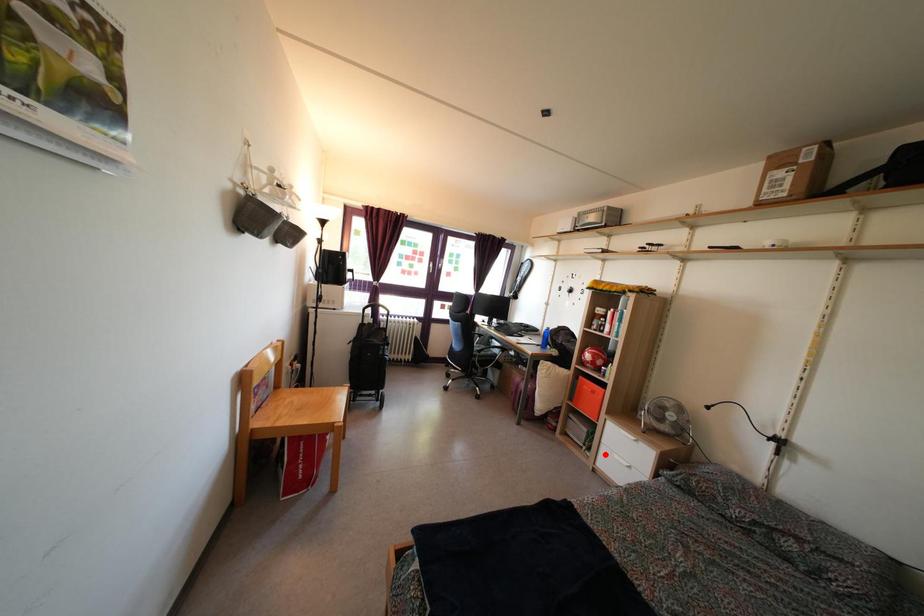
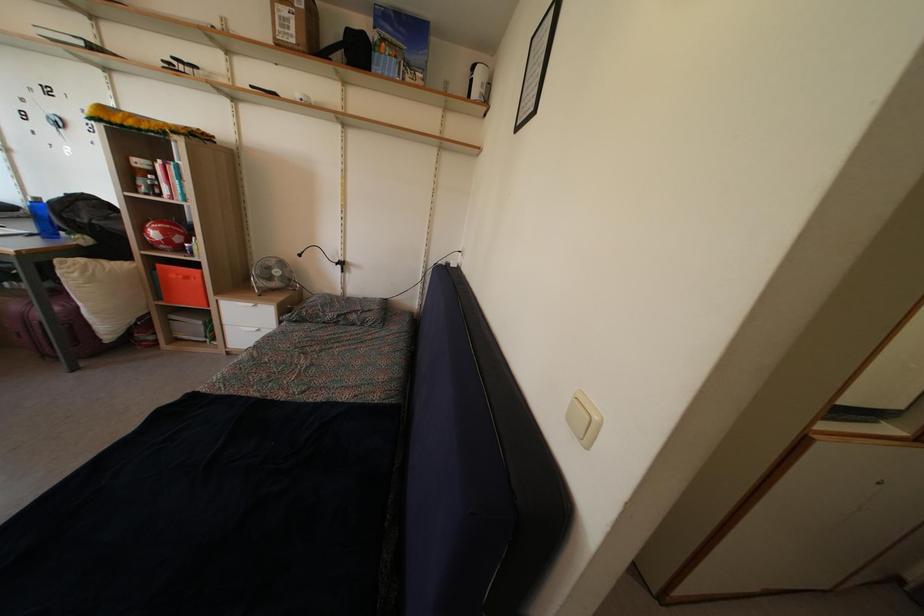
Find the pixel in the second image that matches the highlighted location in the first image.

(228, 336)